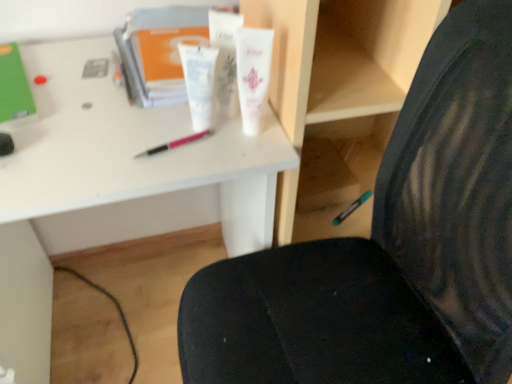
Question: Considering the relative sizes of green matte marker at lower right, which is counted as the first stationery, starting from the back, and green matte folder at upper left, arranged as the first stationery when viewed from the top, in the image provided, is green matte marker at lower right, which is counted as the first stationery, starting from the back, taller than green matte folder at upper left, arranged as the first stationery when viewed from the top,?

Choices:
 (A) yes
 (B) no

Answer: (B)

Question: Would you consider green matte marker at lower right, the second stationery in the front-to-back sequence, to be distant from green matte folder at upper left, the second stationery from the back?

Choices:
 (A) no
 (B) yes

Answer: (A)

Question: Is green matte marker at lower right, which is counted as the first stationery, starting from the back, closer to camera compared to green matte folder at upper left, arranged as the 2th stationery when ordered from the bottom?

Choices:
 (A) no
 (B) yes

Answer: (A)

Question: Does green matte marker at lower right, which is counted as the first stationery, starting from the back, come behind green matte folder at upper left, positioned as the first stationery in front-to-back order?

Choices:
 (A) no
 (B) yes

Answer: (B)

Question: Is green matte marker at lower right, which is counted as the first stationery, starting from the back, with green matte folder at upper left, positioned as the first stationery in front-to-back order?

Choices:
 (A) no
 (B) yes

Answer: (A)

Question: From the image's perspective, is white plastic desk at center located above or below white glossy tube at center, positioned as the 3th toiletry in right-to-left order?

Choices:
 (A) above
 (B) below

Answer: (B)

Question: From a real-world perspective, relative to white glossy tube at center, arranged as the 1th toiletry when viewed from the left, is white plastic desk at center vertically above or below?

Choices:
 (A) below
 (B) above

Answer: (A)

Question: In the image, is white plastic desk at center on the left side or the right side of white glossy tube at center, arranged as the 1th toiletry when viewed from the left?

Choices:
 (A) right
 (B) left

Answer: (B)

Question: Is white plastic desk at center inside the boundaries of white glossy tube at center, positioned as the 3th toiletry in right-to-left order, or outside?

Choices:
 (A) inside
 (B) outside

Answer: (B)

Question: Considering the positions of green matte marker at lower right, which is the first stationery from bottom to top, and white matte tube at center, the third toiletry viewed from the left, in the image, is green matte marker at lower right, which is the first stationery from bottom to top, bigger or smaller than white matte tube at center, the third toiletry viewed from the left,?

Choices:
 (A) big
 (B) small

Answer: (B)

Question: Relative to white matte tube at center, positioned as the first toiletry in right-to-left order, is green matte marker at lower right, the first stationery from the right, in front or behind?

Choices:
 (A) behind
 (B) front

Answer: (A)

Question: Is green matte marker at lower right, which is counted as the first stationery, starting from the back, inside or outside of white matte tube at center, the third toiletry viewed from the left?

Choices:
 (A) outside
 (B) inside

Answer: (A)

Question: From a real-world perspective, is green matte marker at lower right, the first stationery from the right, positioned above or below white matte tube at center, the third toiletry viewed from the left?

Choices:
 (A) below
 (B) above

Answer: (A)

Question: Looking at the image, does white matte tube at center, positioned as the first toiletry in right-to-left order, seem bigger or smaller compared to green matte folder at upper left, positioned as the first stationery in front-to-back order?

Choices:
 (A) big
 (B) small

Answer: (B)

Question: Is white matte tube at center, the third toiletry viewed from the left, in front of or behind green matte folder at upper left, the 1th stationery from the left, in the image?

Choices:
 (A) behind
 (B) front

Answer: (B)